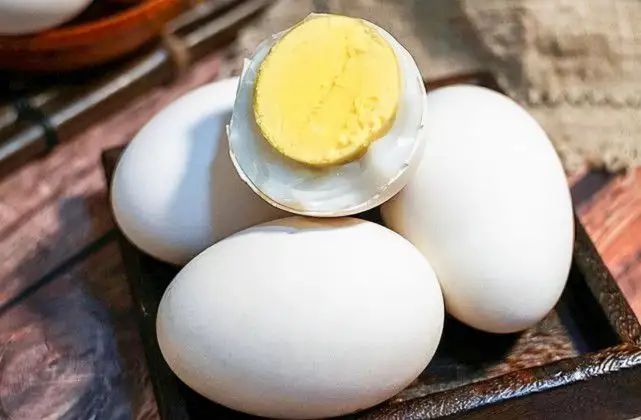
You are a GUI agent. You are given a task and a screenshot of the screen. Output one action in this format:
    pyautogui.click(x=<x>, y=<y>)
    Task: Click on the plate wood
    
    Given the screenshot: What is the action you would take?
    click(x=96, y=86)